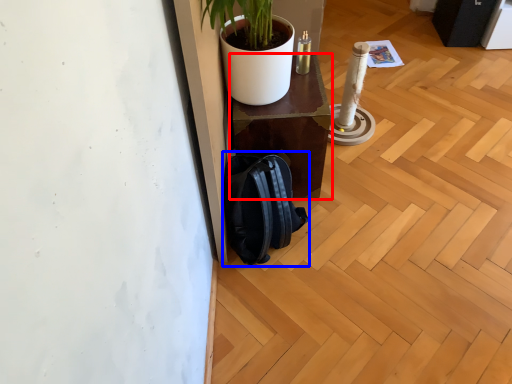
Question: Which of the following is the closest to the observer, furniture (highlighted by a red box) or backpack (highlighted by a blue box)?

Choices:
 (A) furniture
 (B) backpack

Answer: (B)